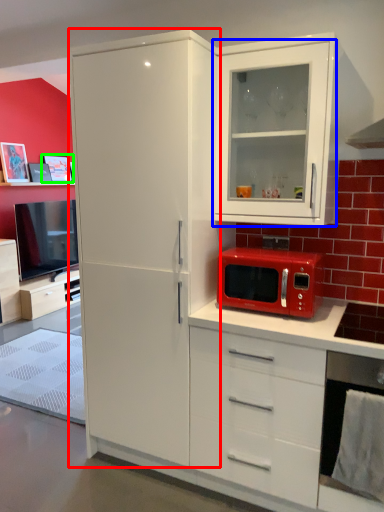
Question: Considering the real-world distances, which object is closest to refrigerator (highlighted by a red box)? cabinetry (highlighted by a blue box) or picture frame (highlighted by a green box).

Choices:
 (A) cabinetry
 (B) picture frame

Answer: (A)